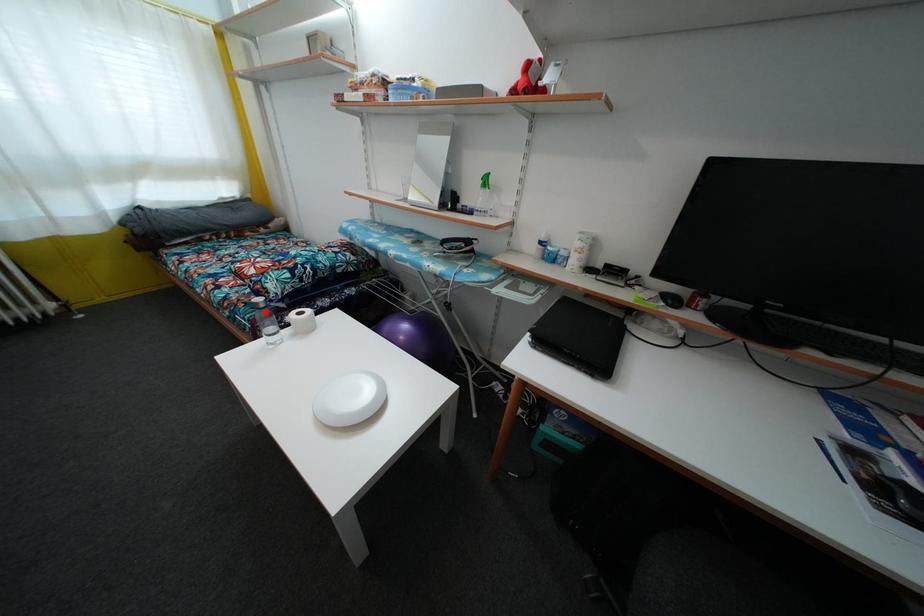
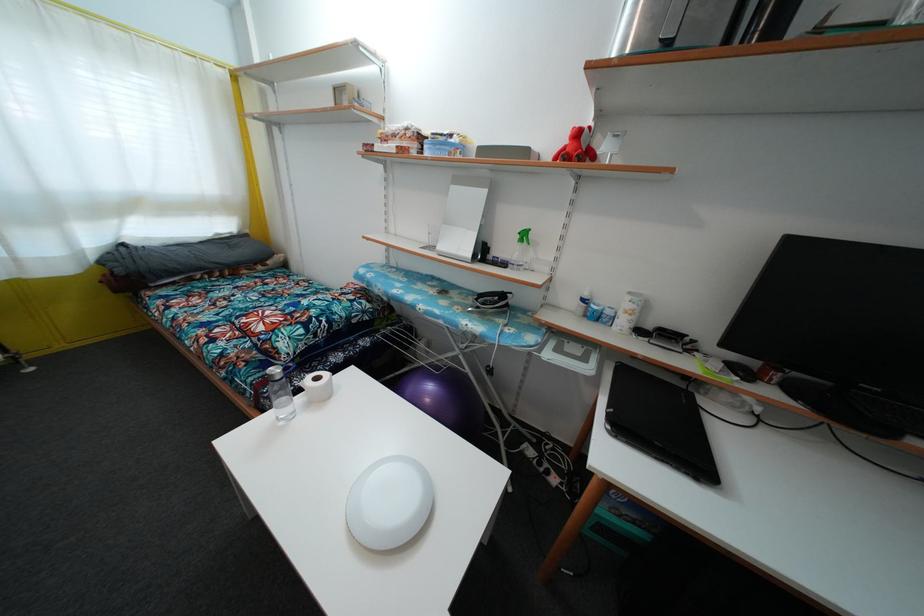
Where in the second image is the point corresponding to the highlighted location from the first image?

(282, 384)